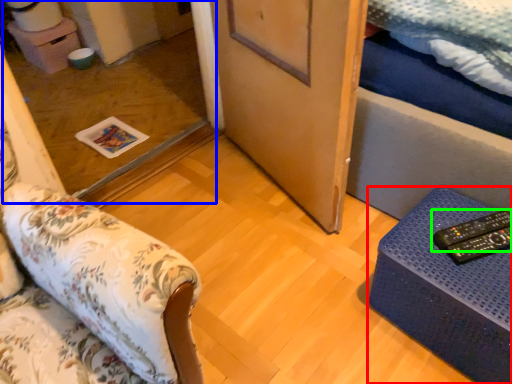
Question: Which object is the farthest from furniture (highlighted by a red box)? Choose among these: glass door (highlighted by a blue box) or remote (highlighted by a green box).

Choices:
 (A) glass door
 (B) remote

Answer: (A)